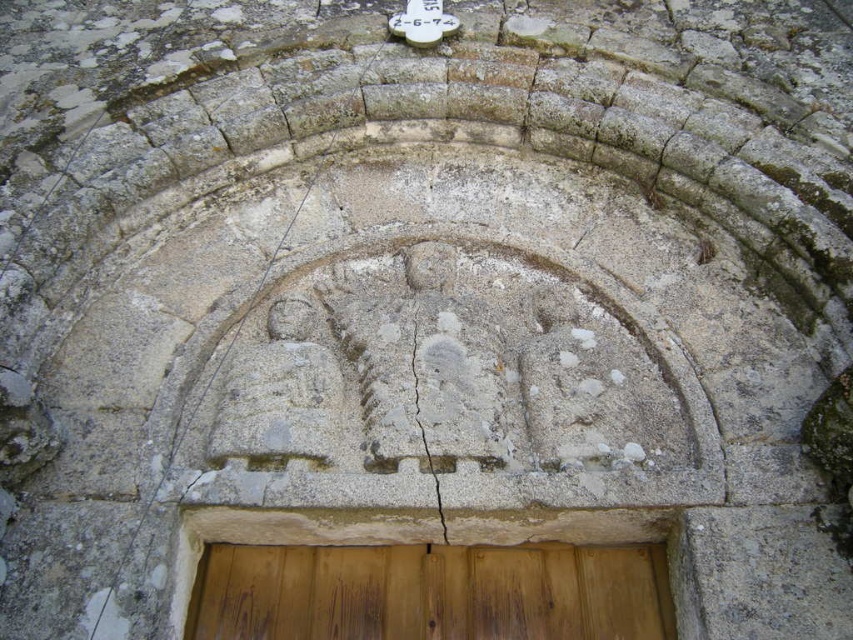
Question: Which point is closer to the camera?

Choices:
 (A) cracked stone at center
 (B) wooden door at center

Answer: (A)

Question: Is the position of wooden door at center less distant than that of cracked stone at center?

Choices:
 (A) yes
 (B) no

Answer: (B)

Question: Considering the relative positions of wooden door at center and cracked stone at center in the image provided, where is wooden door at center located with respect to cracked stone at center?

Choices:
 (A) left
 (B) right

Answer: (B)

Question: Which of the following is the closest to the observer?

Choices:
 (A) (352, 609)
 (B) (415, 365)

Answer: (A)

Question: Does wooden door at center have a smaller size compared to cracked stone at center?

Choices:
 (A) no
 (B) yes

Answer: (A)